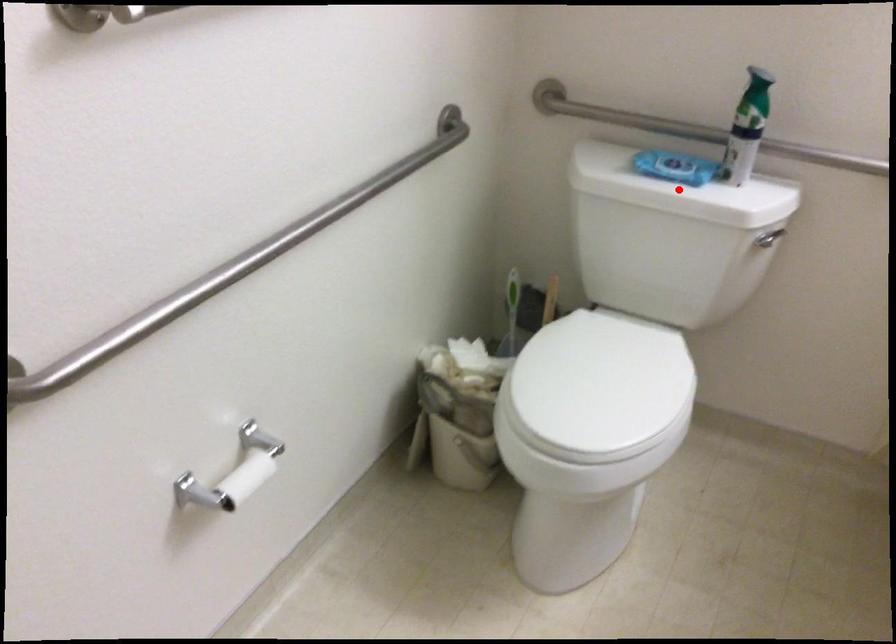
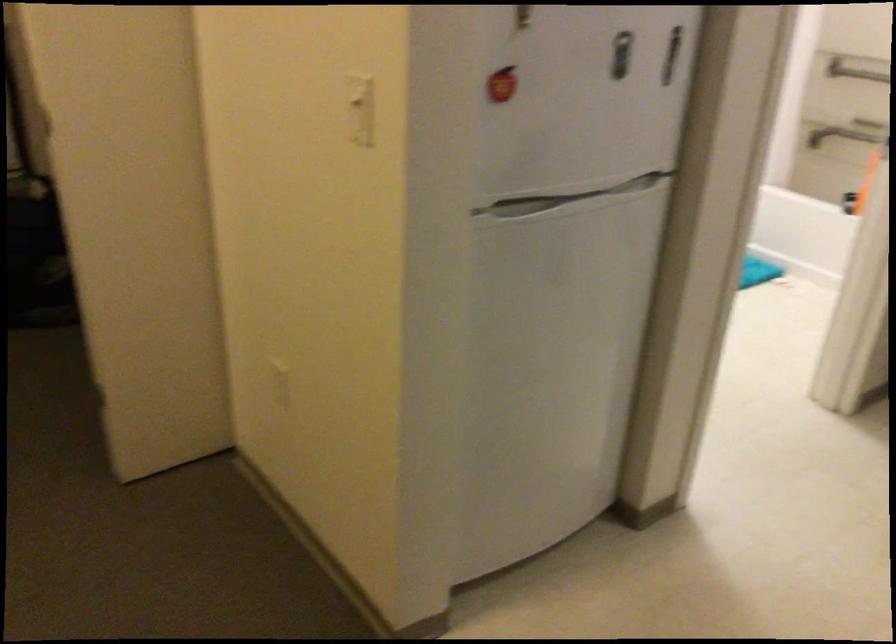
Question: I am providing you with two images of the same scene from different viewpoints. A red point is marked on the first image. Is the red point's position out of view in image 2?

Choices:
 (A) Yes
 (B) No

Answer: (A)